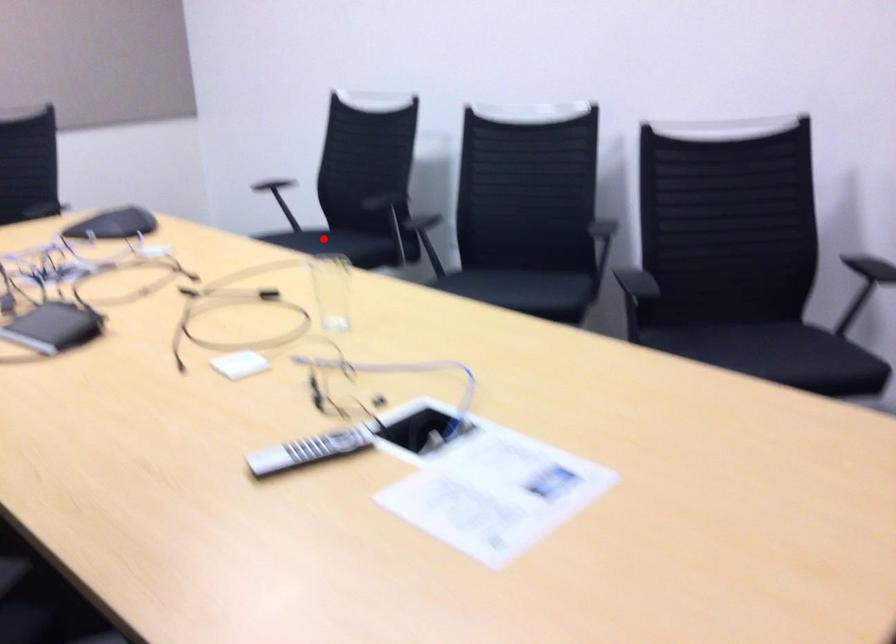
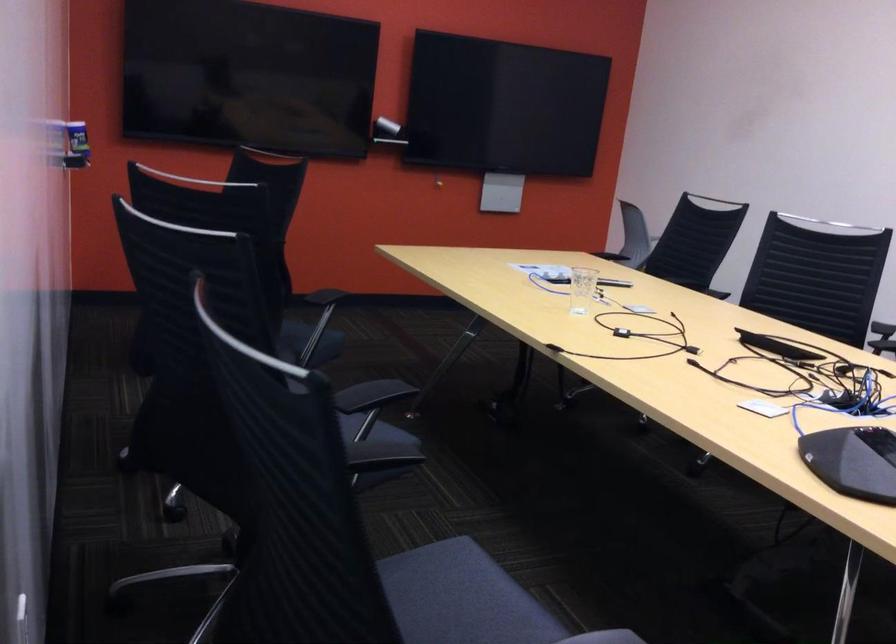
The point at the highlighted location is marked in the first image. Where is the corresponding point in the second image?

(461, 598)